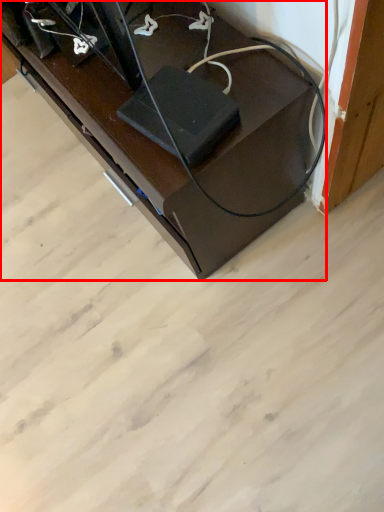
Question: From the image's perspective, where is furniture (annotated by the red box) located in relation to wide in the image?

Choices:
 (A) above
 (B) below

Answer: (A)